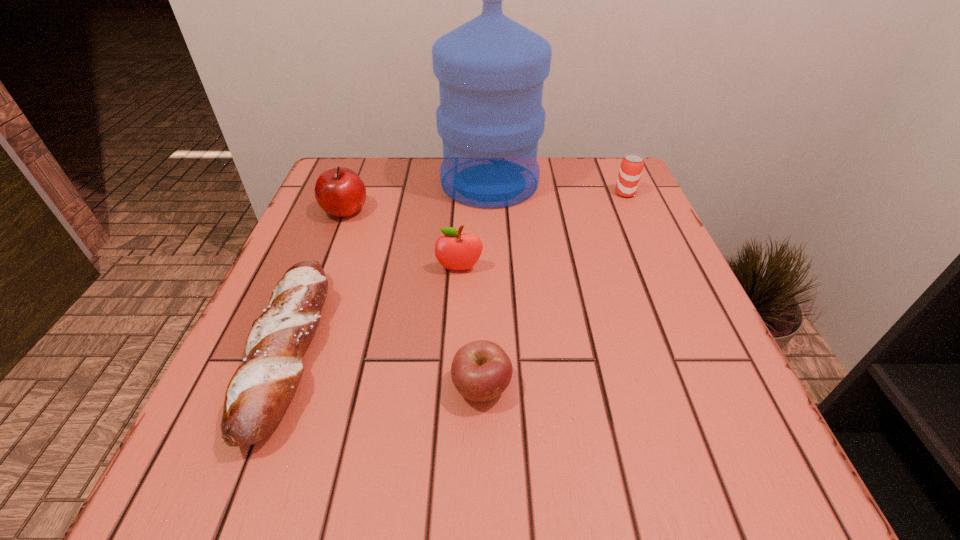
At what (x,y) coordinates should I click in order to perform the action: click on blank space located on the right of the baguet. Please return your answer as a coordinate pair (x, y). The height and width of the screenshot is (540, 960). Looking at the image, I should click on (487, 351).

Where is `water jug located in the far edge section of the desktop`? water jug located in the far edge section of the desktop is located at coordinates (491, 70).

Find the location of a particular element. apple at the far edge is located at coordinates (340, 192).

You are a GUI agent. You are given a task and a screenshot of the screen. Output one action in this format:
    pyautogui.click(x=<x>, y=<y>)
    Task: Click on the beer can that is at the far edge
    Image resolution: width=960 pixels, height=540 pixels.
    Given the screenshot: What is the action you would take?
    pyautogui.click(x=631, y=168)

In order to click on object that is at the near edge in this screenshot , I will do `click(259, 392)`.

Locate an element on the screen. The height and width of the screenshot is (540, 960). apple present at the left edge is located at coordinates (340, 192).

Identify the location of baguet present at the left edge. Image resolution: width=960 pixels, height=540 pixels. (x=259, y=392).

Where is `object positioned at the right edge`? The width and height of the screenshot is (960, 540). object positioned at the right edge is located at coordinates (631, 168).

At what (x,y) coordinates should I click in order to perform the action: click on object at the far left corner. Please return your answer as a coordinate pair (x, y). Looking at the image, I should click on (340, 192).

Locate an element on the screen. object that is at the near left corner is located at coordinates (259, 392).